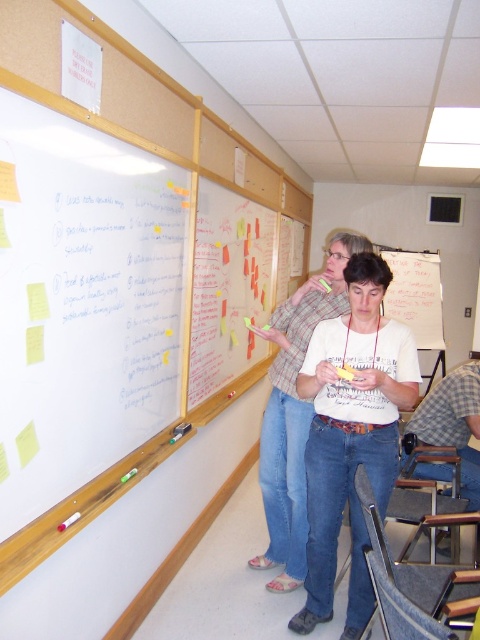
You are a teacher who wants to write on the white matte dry erase board at upper left but notices the white cotton shirt at center is in the way. Can you reach the board without moving the shirt?

The white matte dry erase board at upper left has a lesser height compared to white cotton shirt at center, meaning the board is shorter. Since the shirt is at center, it might be blocking the board. However, since the board is shorter, you might still reach it by bending down or moving slightly to the side.